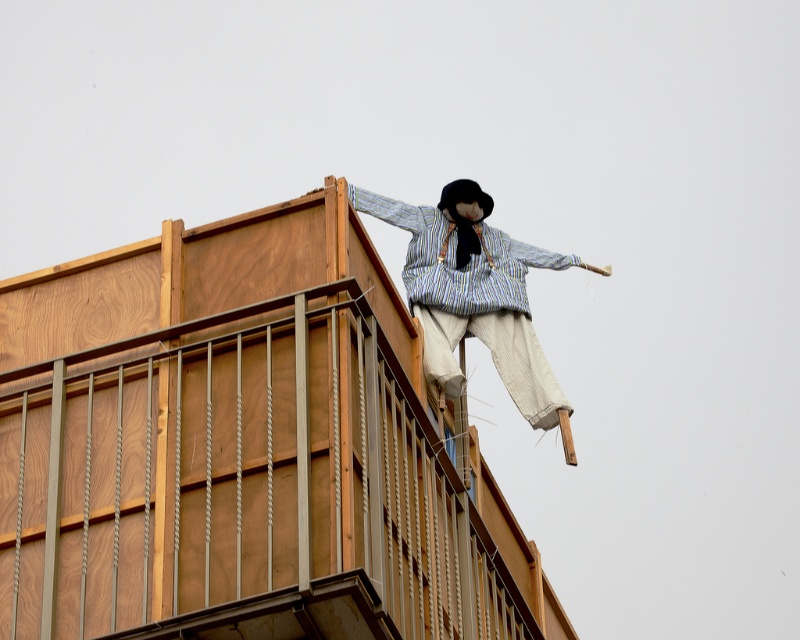
You are standing at the base of the wooden structure and looking up at the wooden at upper center and the striped fabric scarecrow at upper center. Which object is positioned higher relative to the other?

The striped fabric scarecrow at upper center is positioned higher than the wooden at upper center because the wooden at upper center is located below it.

You are a construction worker standing on the wooden structure. You need to place a safety net that can cover a distance of 10 meters between the wooden at upper center and the striped fabric scarecrow at upper center. Is the distance sufficient for the safety net to cover both objects?

The wooden at upper center is 9.84 meters from the striped fabric scarecrow at upper center, so the safety net with a 10 meter coverage can cover both objects since the distance is slightly less than the net capacity.

You are a painter standing at the base of the wooden structure. You want to paint the striped fabric scarecrow at upper center but need to ensure there is enough space between it and the wooden at upper center to avoid splattering paint. Given that your spray paint can cover an area of 30 cm, is there sufficient space between the two?

The wooden at upper center is wider than the striped fabric scarecrow at upper center. However, the exact distance between them isn